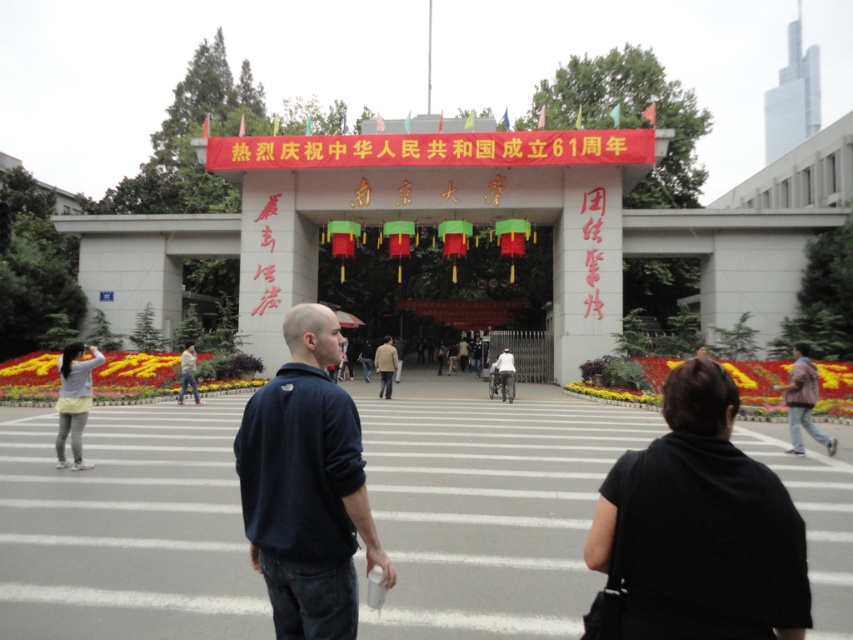
You are a photographer standing at the entrance of Nanjing University. You see a person wearing a dark blue fleece at center and another wearing a light brown leather jacket at center. Which clothing item is shorter in height?

The dark blue fleece at center is shorter than the light brown leather jacket at center.